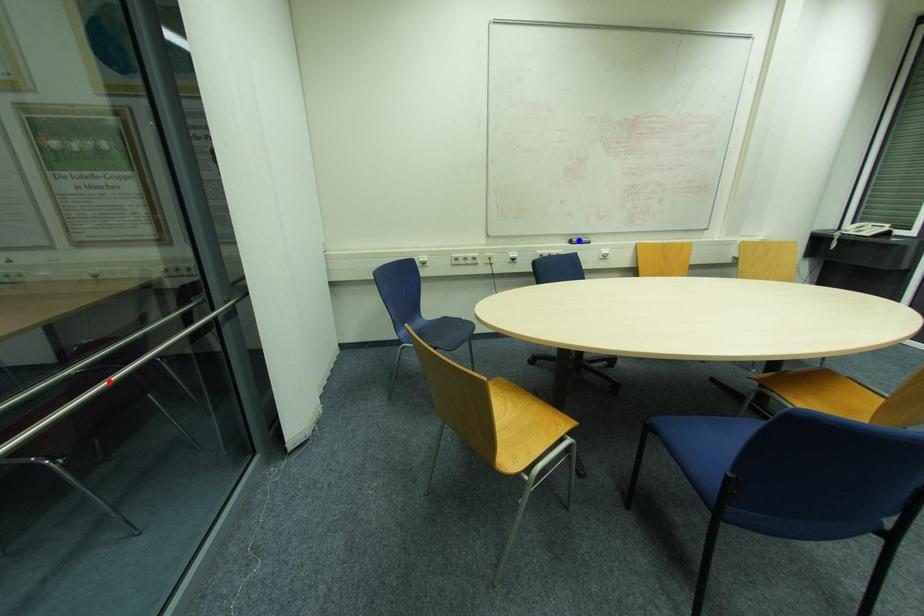
Question: Two points are marked on the image. Which point is closer to the camera?

Choices:
 (A) Blue point is closer.
 (B) Red point is closer.

Answer: (B)